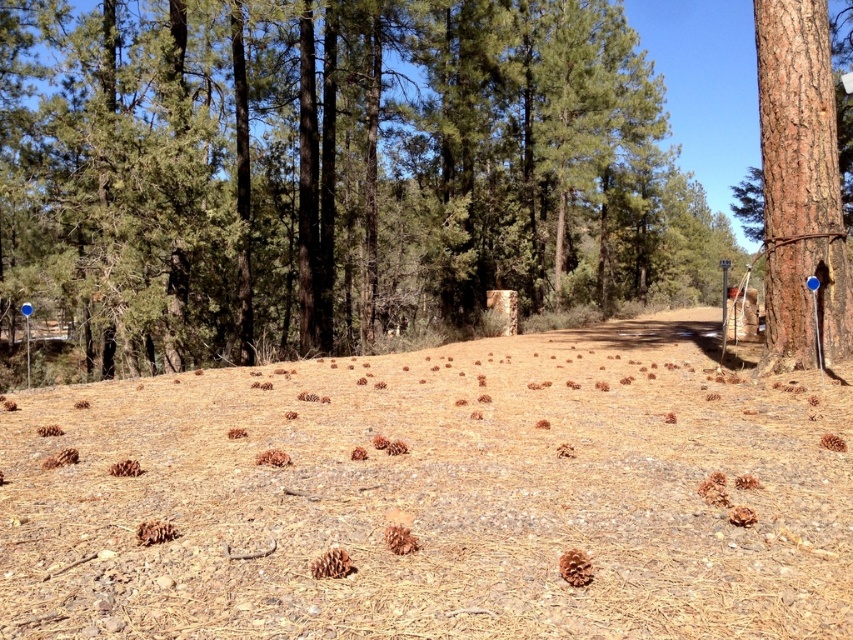
From the picture: Who is more forward, (496, 168) or (801, 324)?

Point (801, 324)

Which is behind, point (109, 35) or point (833, 230)?

Positioned behind is point (109, 35).

What do you see at coordinates (332, 173) in the screenshot?
I see `green textured tree at center` at bounding box center [332, 173].

Find the location of a particular element. The image size is (853, 640). green textured tree at center is located at coordinates (332, 173).